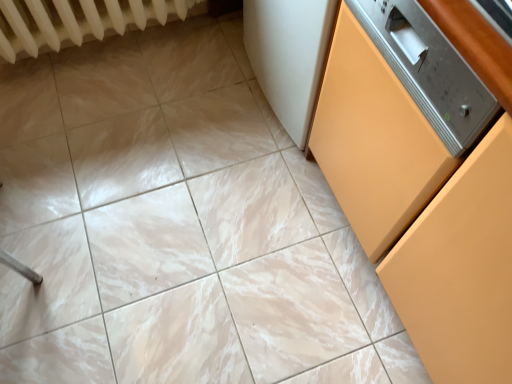
Question: Is matte orange cabinet at right inside or outside of white textured radiator at upper left?

Choices:
 (A) inside
 (B) outside

Answer: (B)

Question: Looking at their shapes, would you say matte orange cabinet at right is wider or thinner than white textured radiator at upper left?

Choices:
 (A) thin
 (B) wide

Answer: (B)

Question: From a real-world perspective, is matte orange cabinet at right above or below white textured radiator at upper left?

Choices:
 (A) above
 (B) below

Answer: (A)

Question: Is white textured radiator at upper left taller or shorter than matte orange cabinet at right?

Choices:
 (A) tall
 (B) short

Answer: (B)

Question: Does point (26, 23) appear closer or farther from the camera than point (463, 339)?

Choices:
 (A) closer
 (B) farther

Answer: (B)

Question: Visually, is white textured radiator at upper left positioned to the left or to the right of matte orange cabinet at right?

Choices:
 (A) right
 (B) left

Answer: (B)

Question: Is white textured radiator at upper left in front of or behind matte orange cabinet at right in the image?

Choices:
 (A) behind
 (B) front

Answer: (A)